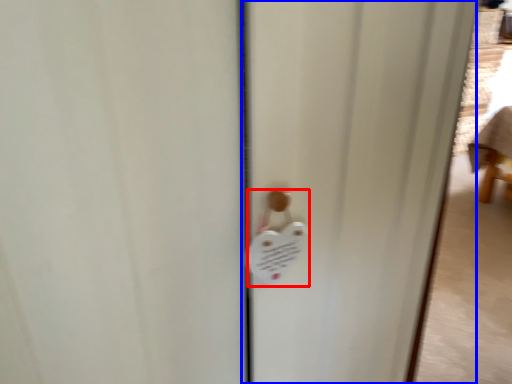
Question: Which point is closer to the camera, lock (highlighted by a red box) or screen door (highlighted by a blue box)?

Choices:
 (A) lock
 (B) screen door

Answer: (A)